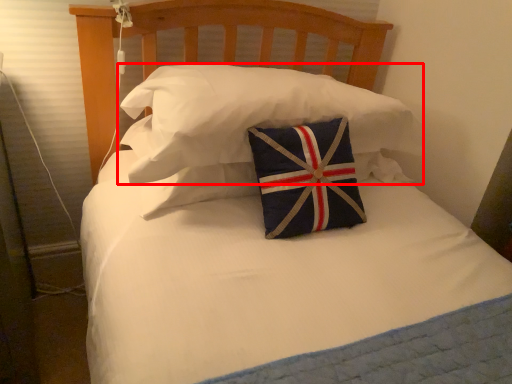
Question: Where is pillow (annotated by the red box) located in relation to pillow in the image?

Choices:
 (A) right
 (B) left

Answer: (A)